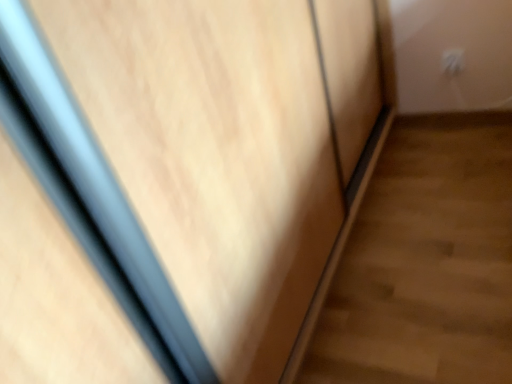
Measure the distance between white glossy electric outlet at upper right and camera.

white glossy electric outlet at upper right is 5.71 feet away from camera.

Find the location of a particular element. The width and height of the screenshot is (512, 384). white glossy electric outlet at upper right is located at coordinates (452, 61).

What do you see at coordinates (452, 61) in the screenshot? I see `white glossy electric outlet at upper right` at bounding box center [452, 61].

The width and height of the screenshot is (512, 384). Identify the location of white glossy electric outlet at upper right. coord(452,61).